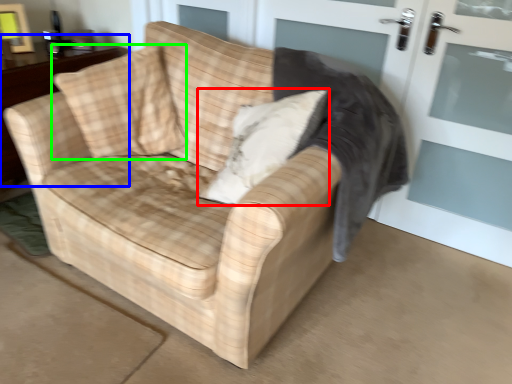
Question: Considering the real-world distances, which object is closest to throw pillow (highlighted by a red box)? table (highlighted by a blue box) or throw pillow (highlighted by a green box).

Choices:
 (A) table
 (B) throw pillow

Answer: (B)